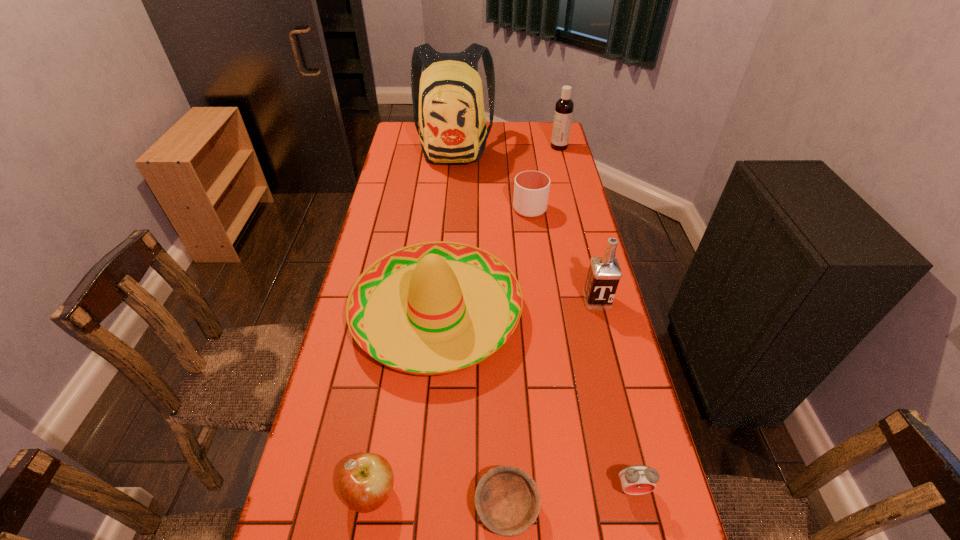
Identify the location of vacant region located 0.120m on the label side of the dishwasher detergent. This screenshot has height=540, width=960. (523, 147).

Identify the location of vacant space located on the label side of the dishwasher detergent. (461, 147).

Where is `free space located on the front label of the vodka`? Image resolution: width=960 pixels, height=540 pixels. free space located on the front label of the vodka is located at coordinates (607, 338).

The width and height of the screenshot is (960, 540). In order to click on free location located on the right of the sombrero in this screenshot , I will do `click(597, 313)`.

The image size is (960, 540). Identify the location of vacant space situated on the front of the cup. (536, 255).

The width and height of the screenshot is (960, 540). Identify the location of free region located on the face of the alarm clock. (640, 525).

The height and width of the screenshot is (540, 960). In order to click on vacant space located on the right of the apple in this screenshot , I will do `click(444, 493)`.

This screenshot has width=960, height=540. I want to click on backpack that is at the far edge, so click(x=447, y=98).

I want to click on dishwasher detergent that is positioned at the far edge, so click(564, 106).

Where is `backpack that is at the left edge`? backpack that is at the left edge is located at coordinates (447, 98).